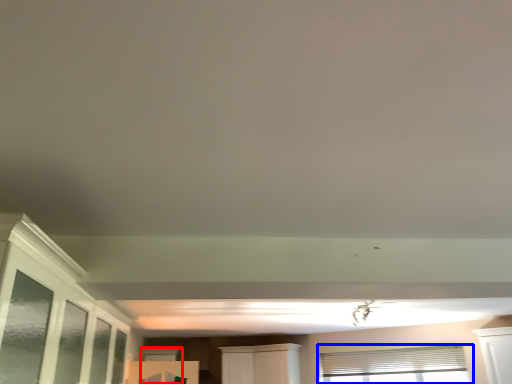
Question: Which object appears closest to the camera in this image, window (highlighted by a red box) or window (highlighted by a blue box)?

Choices:
 (A) window
 (B) window

Answer: (B)